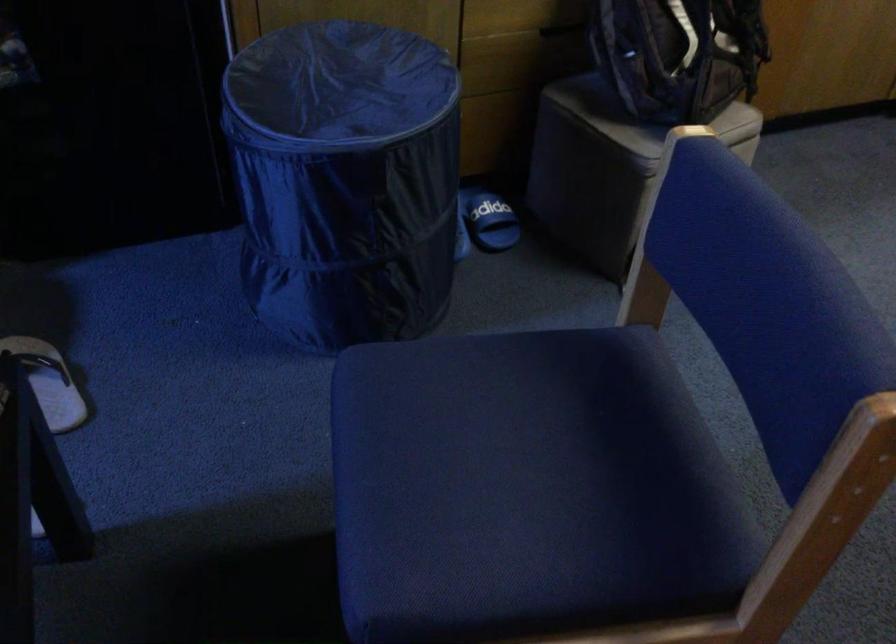
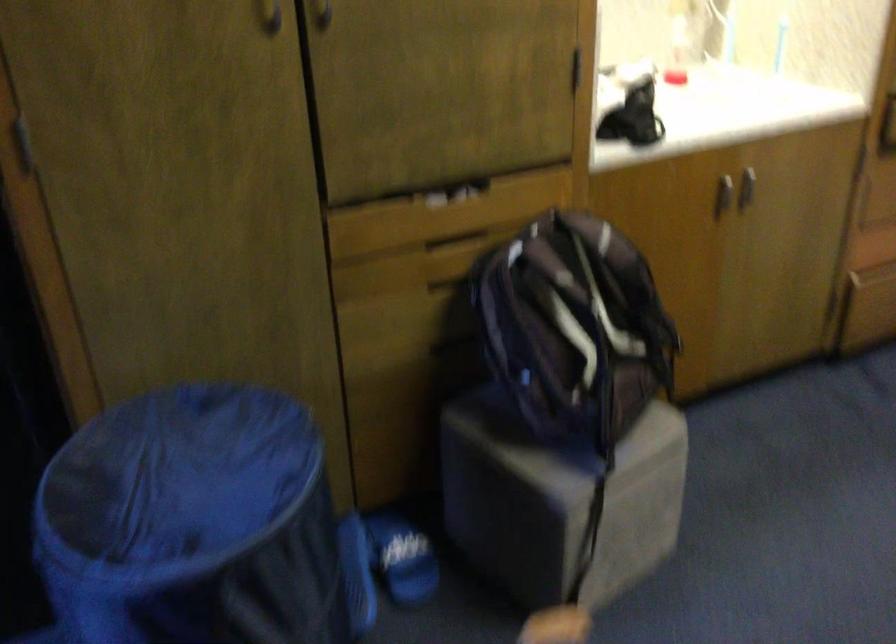
The images are taken continuously from a first-person perspective. In which direction are you moving?

The movement direction of the cameraman is right, forward.